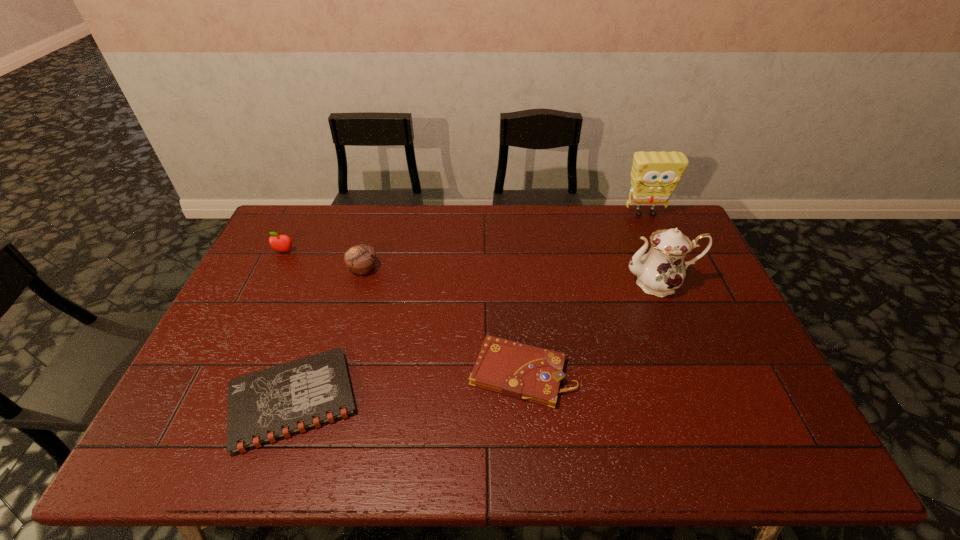
Find the location of a particular element. The width and height of the screenshot is (960, 540). object that is at the near left corner is located at coordinates tap(265, 406).

Image resolution: width=960 pixels, height=540 pixels. I want to click on object that is at the far right corner, so click(655, 175).

Where is `vacant region at the far edge of the desktop`? The height and width of the screenshot is (540, 960). vacant region at the far edge of the desktop is located at coordinates (508, 206).

Find the location of `free space at the near edge`. free space at the near edge is located at coordinates (621, 427).

Where is `vacant region at the left edge`? vacant region at the left edge is located at coordinates (285, 307).

In the image, there is a desktop. Where is `free space at the right edge`? free space at the right edge is located at coordinates (649, 247).

At what (x,y) coordinates should I click in order to perform the action: click on vacant space at the far left corner of the desktop. Please return your answer as a coordinate pair (x, y). Looking at the image, I should click on [x=316, y=237].

Where is `free point at the far right corner`? free point at the far right corner is located at coordinates (646, 214).

The image size is (960, 540). Find the location of `empty space between the right notebook and the chinaware`. empty space between the right notebook and the chinaware is located at coordinates (590, 328).

I want to click on free space between the taller notebook and the second farthest object, so click(x=403, y=312).